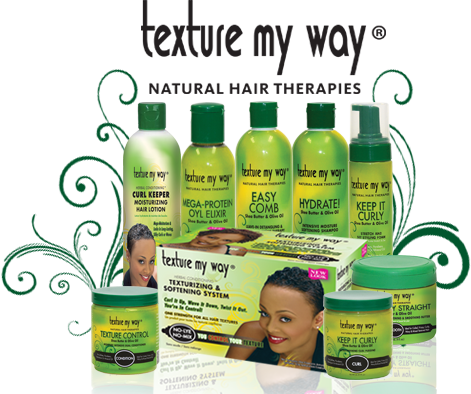
The height and width of the screenshot is (394, 471). In order to click on beauty supplies in this screenshot , I will do `click(122, 327)`, `click(270, 302)`, `click(341, 319)`, `click(396, 295)`, `click(145, 264)`, `click(198, 188)`, `click(271, 188)`, `click(317, 185)`, `click(363, 187)`.